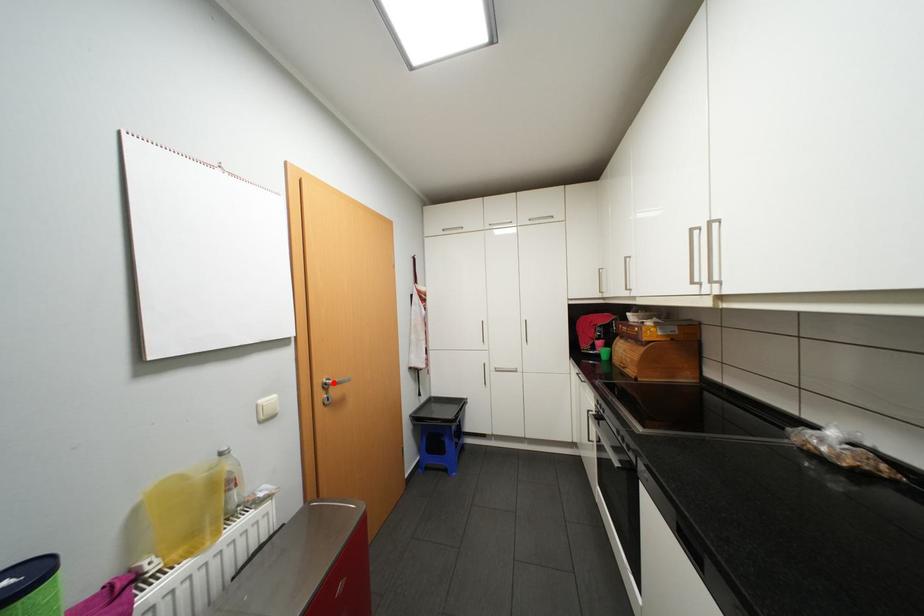
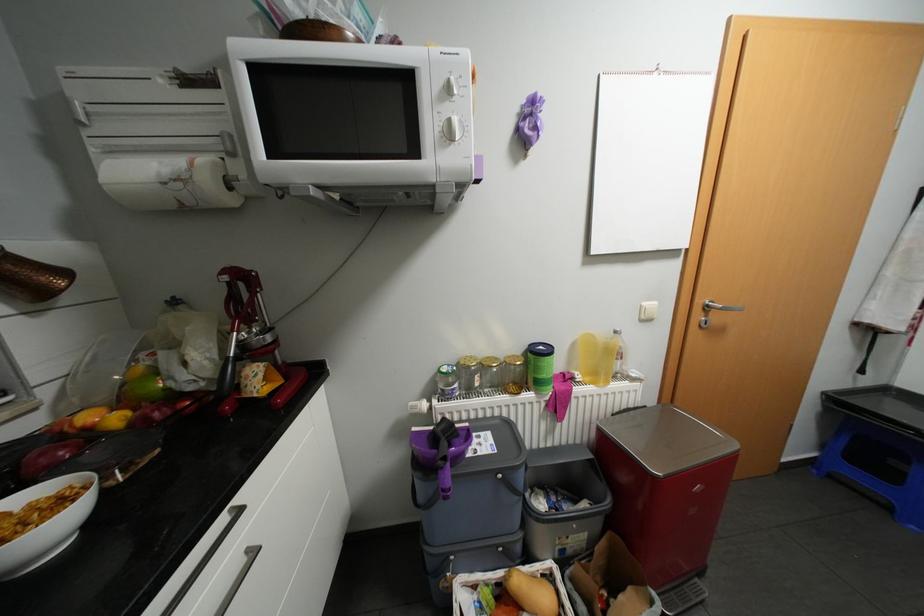
Where in the second image is the point corresponding to the highlighted location from the first image?

(715, 305)